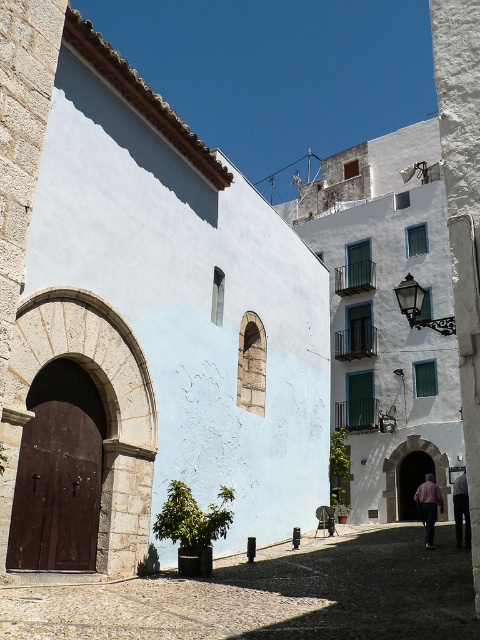
Question: Estimate the real-world distances between objects in this image. Which object is farther from the pink fabric shirt at lower right?

Choices:
 (A) brown stone archway at left
 (B) pink fabric at lower right
 (C) smooth stone archway at center

Answer: (A)

Question: Where is pink fabric shirt at lower right located in relation to pink fabric at lower right in the image?

Choices:
 (A) left
 (B) right

Answer: (A)

Question: Among these points, which one is farthest from the camera?

Choices:
 (A) (403, 476)
 (B) (459, 520)
 (C) (340, 611)
 (D) (74, 384)

Answer: (A)

Question: Among these objects, which one is nearest to the camera?

Choices:
 (A) smooth stone courtyard at center
 (B) pink fabric at lower right
 (C) pink fabric shirt at lower right
 (D) brown stone archway at left

Answer: (A)

Question: Is smooth stone courtyard at center above pink fabric at lower right?

Choices:
 (A) yes
 (B) no

Answer: (A)

Question: Can you confirm if smooth stone archway at center is thinner than pink fabric at lower right?

Choices:
 (A) yes
 (B) no

Answer: (A)